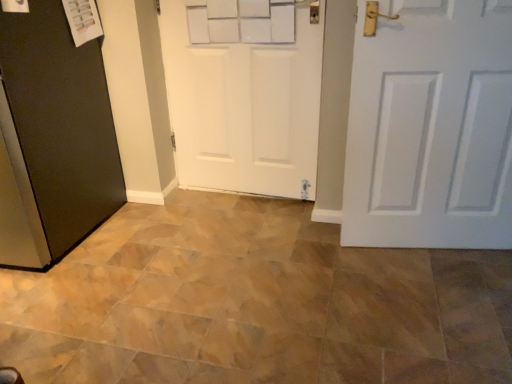
Find the location of a particular element. vacant area to the left of white matte door at center, positioned as the second door in left-to-right order is located at coordinates (168, 211).